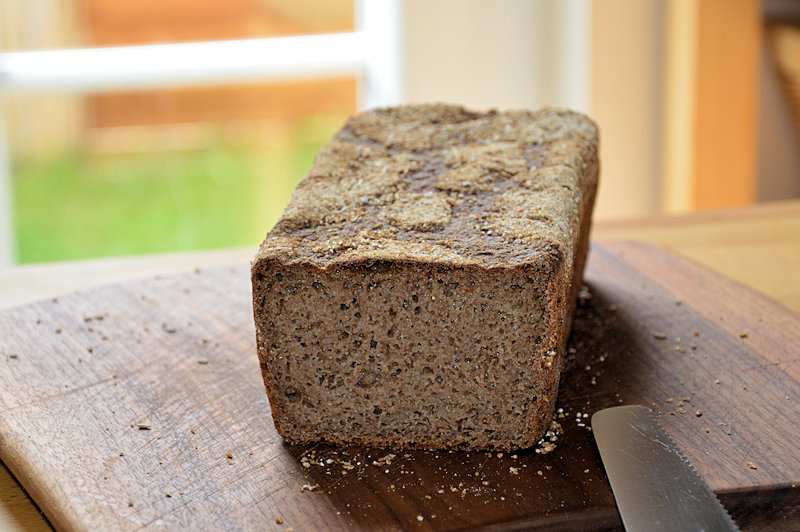
Find the location of a particular element. The width and height of the screenshot is (800, 532). wall is located at coordinates (713, 55).